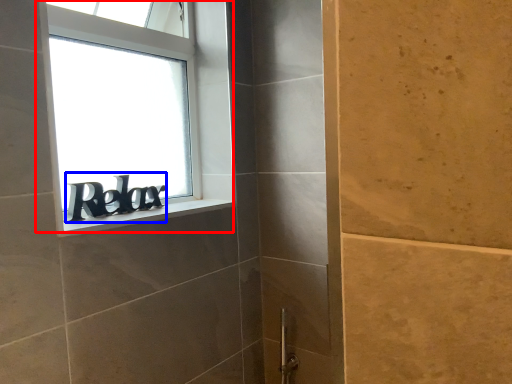
Question: Among these objects, which one is nearest to the camera, window (highlighted by a red box) or writing (highlighted by a blue box)?

Choices:
 (A) window
 (B) writing

Answer: (A)